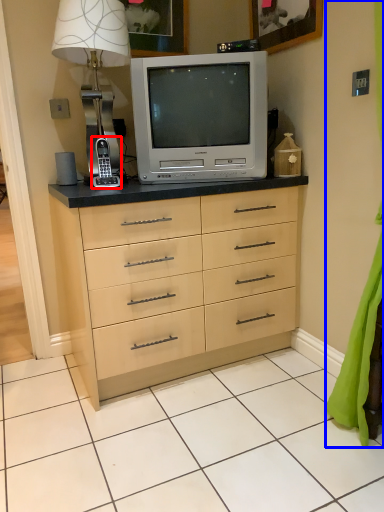
Question: Which of the following is the farthest to the observer, gadget (highlighted by a red box) or curtain (highlighted by a blue box)?

Choices:
 (A) gadget
 (B) curtain

Answer: (A)